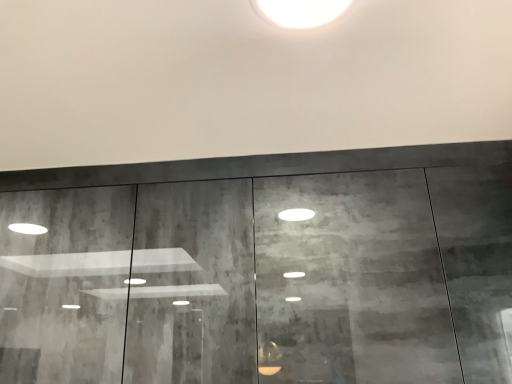
Question: Does white glossy light at upper center appear on the right side of textured concrete door at center?

Choices:
 (A) no
 (B) yes

Answer: (B)

Question: From the image's perspective, is white glossy light at upper center on textured concrete door at center?

Choices:
 (A) no
 (B) yes

Answer: (B)

Question: Is white glossy light at upper center directly adjacent to textured concrete door at center?

Choices:
 (A) yes
 (B) no

Answer: (B)

Question: Is white glossy light at upper center positioned beyond the bounds of textured concrete door at center?

Choices:
 (A) yes
 (B) no

Answer: (A)

Question: From the image's perspective, is white glossy light at upper center under textured concrete door at center?

Choices:
 (A) yes
 (B) no

Answer: (B)

Question: Does white glossy light at upper center lie behind textured concrete door at center?

Choices:
 (A) no
 (B) yes

Answer: (A)

Question: Is textured concrete door at center aimed at white glossy light at upper center?

Choices:
 (A) yes
 (B) no

Answer: (A)

Question: Can you confirm if textured concrete door at center is smaller than white glossy light at upper center?

Choices:
 (A) yes
 (B) no

Answer: (B)

Question: From a real-world perspective, is textured concrete door at center physically below white glossy light at upper center?

Choices:
 (A) yes
 (B) no

Answer: (A)

Question: Does textured concrete door at center lie behind white glossy light at upper center?

Choices:
 (A) yes
 (B) no

Answer: (A)

Question: Can you confirm if textured concrete door at center is wider than white glossy light at upper center?

Choices:
 (A) yes
 (B) no

Answer: (A)

Question: Does textured concrete door at center have a greater height compared to white glossy light at upper center?

Choices:
 (A) yes
 (B) no

Answer: (A)

Question: Choose the correct answer: Is textured concrete door at center inside white glossy light at upper center or outside it?

Choices:
 (A) outside
 (B) inside

Answer: (A)